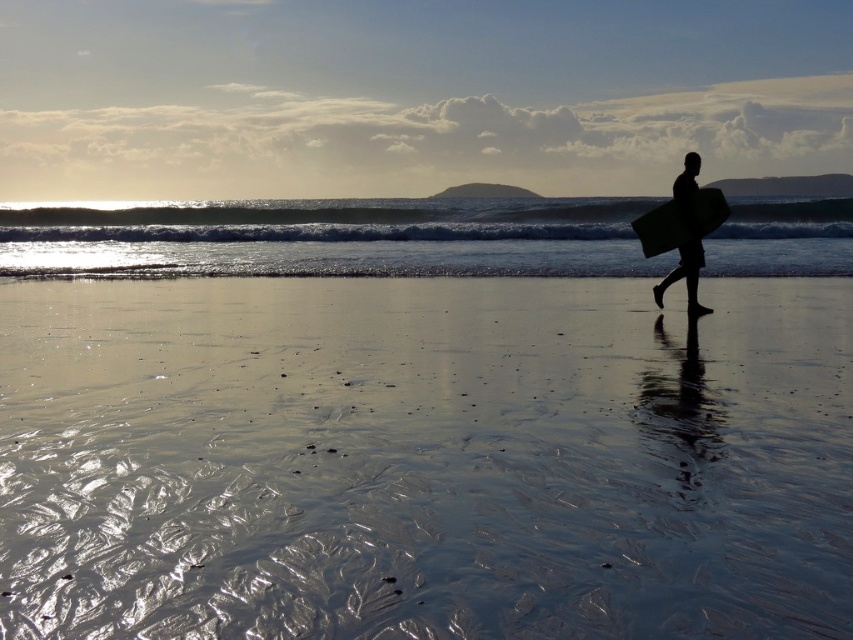
Does shiny sand at lower center appear on the left side of clear blue water at center?

No, shiny sand at lower center is not to the left of clear blue water at center.

Is shiny sand at lower center below clear blue water at center?

Yes, shiny sand at lower center is below clear blue water at center.

Is point (248, 444) farther from camera compared to point (41, 259)?

No, it is in front of (41, 259).

Identify the location of shiny sand at lower center. This screenshot has width=853, height=640. (422, 460).

Is shiny sand at lower center bigger than black matte surfboard at right?

Yes, shiny sand at lower center is bigger than black matte surfboard at right.

This screenshot has width=853, height=640. I want to click on shiny sand at lower center, so 422,460.

Between point (271, 490) and point (674, 182), which one is positioned behind?

The point (674, 182) is more distant.

Identify the location of shiny sand at lower center. The image size is (853, 640). (422, 460).

Who is shorter, black matte surfboard at right or smooth black surfboard at right?

smooth black surfboard at right is shorter.

Describe the element at coordinates (688, 237) in the screenshot. The height and width of the screenshot is (640, 853). I see `black matte surfboard at right` at that location.

The height and width of the screenshot is (640, 853). Find the location of `black matte surfboard at right`. black matte surfboard at right is located at coordinates (688, 237).